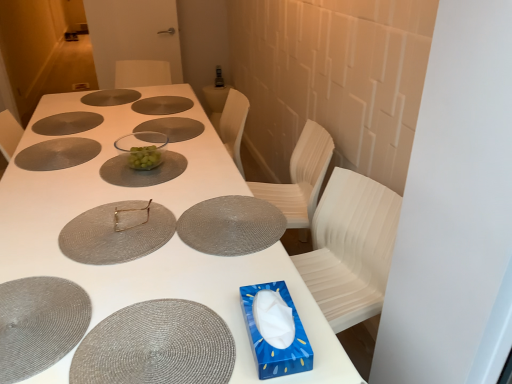
In order to click on vacant region to the left of matte silver fork at center in this screenshot , I will do `click(58, 214)`.